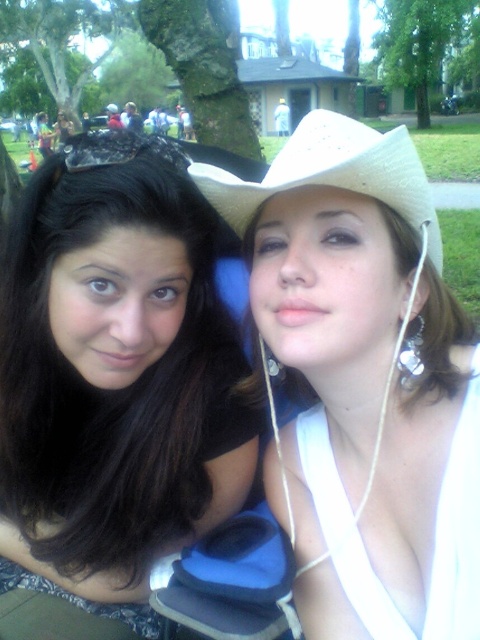
Looking at this image, you are a photographer trying to capture a closeup of the white matte cowboy hat at upper right and the black matte hair at center. Which object should you focus on first if you want to ensure both are in focus without adjusting the camera settings?

The white matte cowboy hat at upper right is located above the black matte hair at center, so focusing on the black matte hair at center first would ensure both are in focus since it is closer to the camera.

You are a photographer trying to capture a closeup shot of the black matte hair at center and the white straw cowboy hat at upper right. Since you want to focus on both objects, which one should you adjust your camera focus on first to ensure both are in focus?

The black matte hair at center is shorter than the white straw cowboy hat at upper right, so you should focus on the white straw cowboy hat at upper right first to ensure both are in focus.

You are holding a 40 inch long pole and want to place it from your current position to the point at coordinates point [358,608]. Can you reach that point with the pole without extending beyond the pole length?

The point [358,608] is 38.33 inches from the camera, so the 40 inch pole can reach it since it is shorter than the pole length.